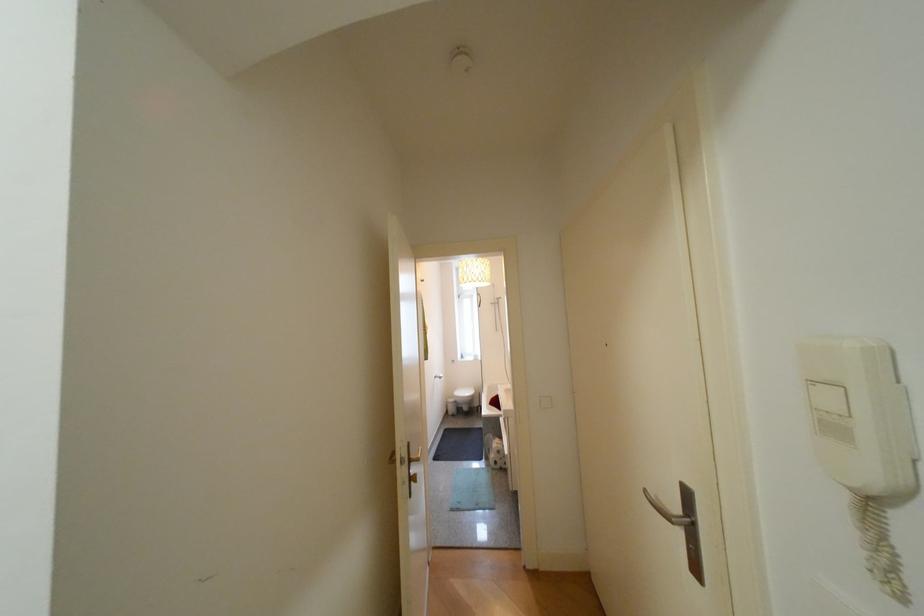
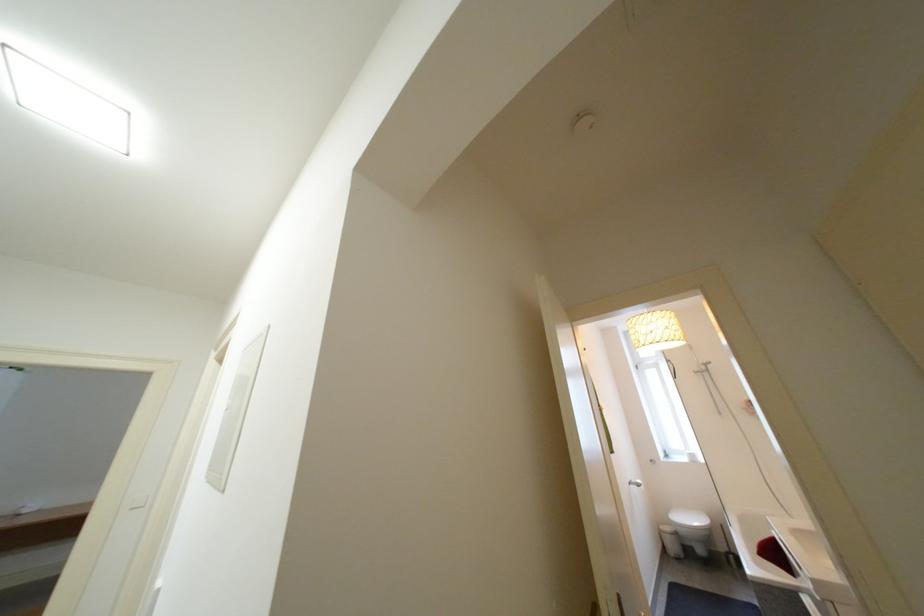
Locate, in the second image, the point that corresponds to (x=475, y=394) in the first image.

(699, 521)